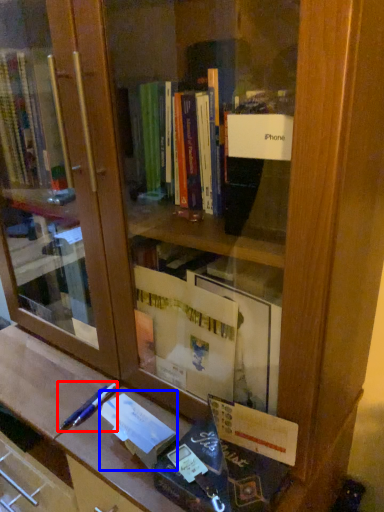
Question: Which point is further to the camera, pencil (highlighted by a red box) or paperback book (highlighted by a blue box)?

Choices:
 (A) pencil
 (B) paperback book

Answer: (A)